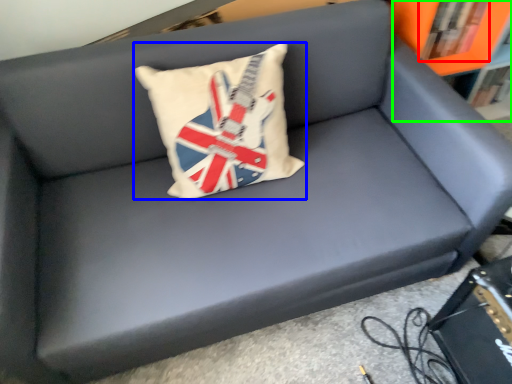
Question: Which is farther away from book (highlighted by a red box)? pillow (highlighted by a blue box) or bookcase (highlighted by a green box)?

Choices:
 (A) pillow
 (B) bookcase

Answer: (A)